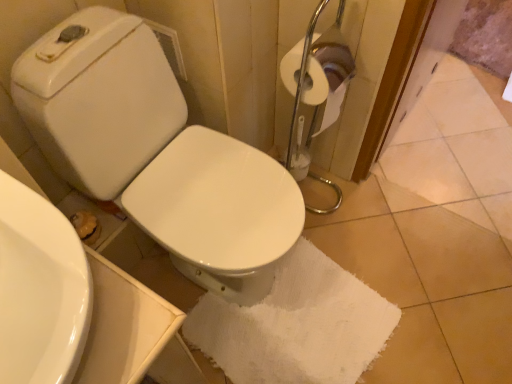
Where is `free point below white glossy sink at lower left (from a real-world perspective)`? The height and width of the screenshot is (384, 512). free point below white glossy sink at lower left (from a real-world perspective) is located at coordinates (54, 315).